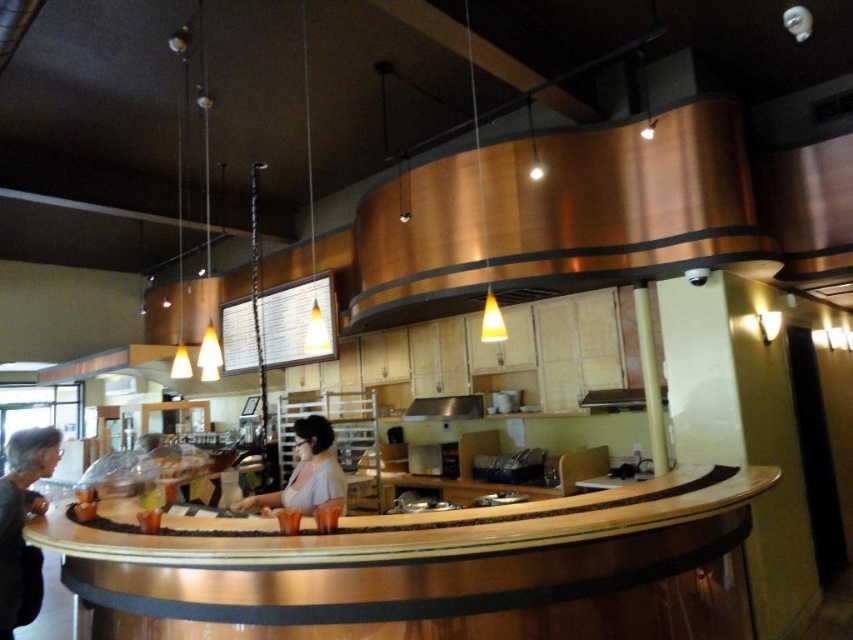
You are a customer in the modern cafe and want to order a drink. You see the wooden counter at center and the light beige fabric shirt at center. Which object is closer to the entrance of the cafe?

The light beige fabric shirt at center is closer to the entrance of the cafe because the wooden counter at center is to the right of it, implying the shirt is positioned more towards the entrance side.

You are a customer trying to reach the items on the wooden counter at center while wearing the light beige fabric shirt at center. Can you comfortably reach the items on the counter without needing to stand on something?

The wooden counter at center is taller than the light beige fabric shirt at center, so it is likely that you would need to stand on something to comfortably reach the items on the counter.